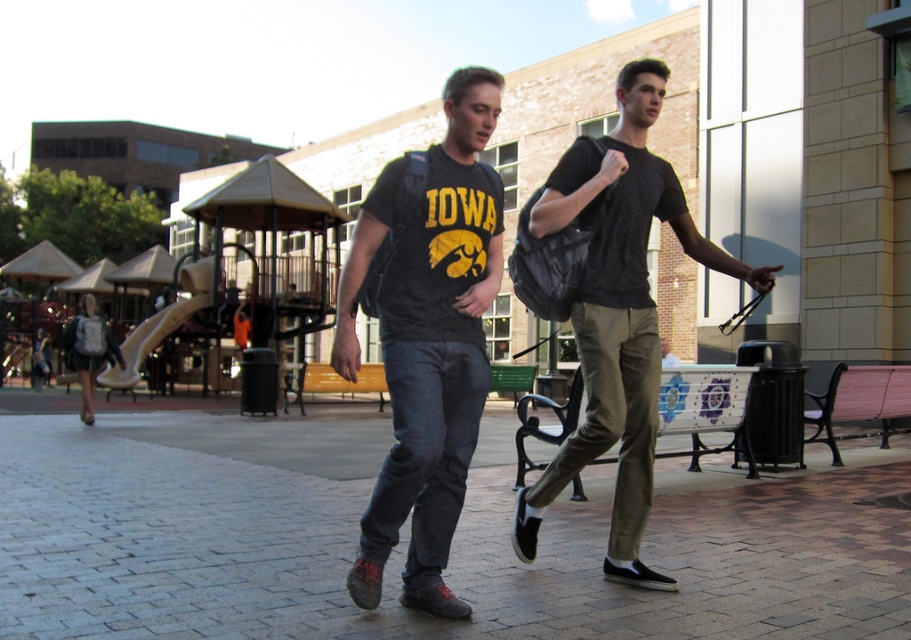
You are standing in the plaza and want to take a photo of the brick pavement at center. According to the coordinates provided, where should you position your camera to capture it best?

The brick pavement at center is located at coordinates point (406, 541), so position your camera there to capture it best.

What is the location of the point with coordinates (406, 541) in the image?

The point with coordinates (406, 541) is located on the brick pavement at center.